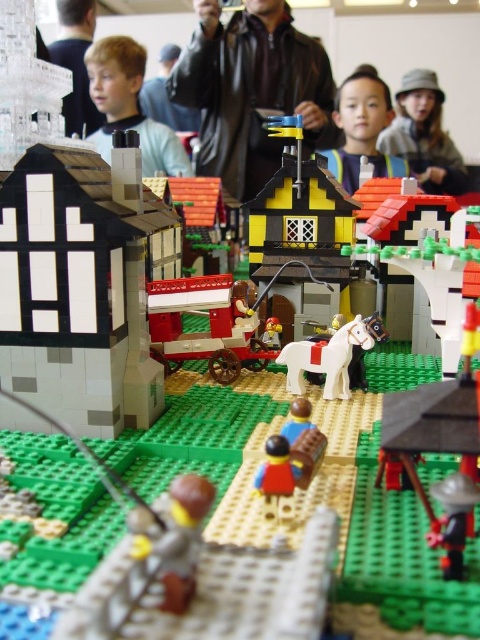
Question: Among these objects, which one is farthest from the camera?

Choices:
 (A) light brown leather jacket at upper center
 (B) light brown hair at upper left
 (C) yellow matte house at center
 (D) light brown hair at upper center

Answer: (A)

Question: Which object is the closest to the blonde hair at upper left?

Choices:
 (A) yellow matte house at center
 (B) light brown hair at upper center

Answer: (B)

Question: Estimate the real-world distances between objects in this image. Which object is closer to the light brown leather jacket at upper center?

Choices:
 (A) shiny red wagon at center
 (B) red plastic minifigure at center
 (C) blonde hair at upper left

Answer: (C)

Question: Can you confirm if shiny red wagon at center is positioned to the right of light brown hair at upper left?

Choices:
 (A) yes
 (B) no

Answer: (A)

Question: Can you confirm if shiny red wagon at center is positioned to the left of light brown leather jacket at upper center?

Choices:
 (A) yes
 (B) no

Answer: (B)

Question: Can you confirm if yellow matte house at center is positioned to the left of light brown hat at upper center?

Choices:
 (A) no
 (B) yes

Answer: (B)